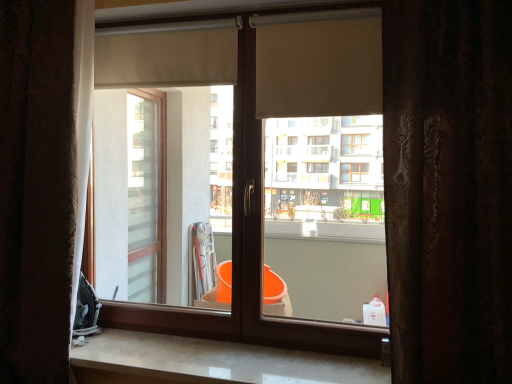
Image resolution: width=512 pixels, height=384 pixels. I want to click on empty space that is ontop of white marble counter top at lower center (from a real-world perspective), so click(x=223, y=358).